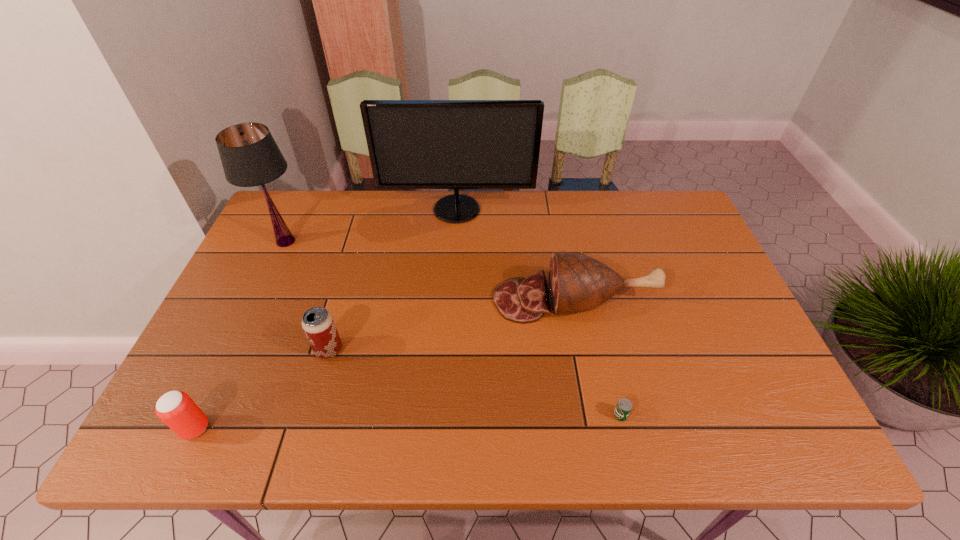
You are a GUI agent. You are given a task and a screenshot of the screen. Output one action in this format:
    pyautogui.click(x=<x>, y=<y>)
    Task: Click on the object that is at the far left corner
    This screenshot has width=960, height=540.
    Given the screenshot: What is the action you would take?
    pyautogui.click(x=250, y=157)

At what (x,y) coordinates should I click in order to perform the action: click on object that is positioned at the near left corner. Please return your answer as a coordinate pair (x, y). The width and height of the screenshot is (960, 540). Looking at the image, I should click on (176, 409).

Image resolution: width=960 pixels, height=540 pixels. I want to click on vacant space at the far edge of the desktop, so (353, 214).

Where is `vacant space at the near edge of the desktop`? The image size is (960, 540). vacant space at the near edge of the desktop is located at coordinates (546, 418).

The height and width of the screenshot is (540, 960). What are the coordinates of `free spot at the left edge of the desktop` in the screenshot? It's located at (247, 320).

Identify the location of vacant space at the right edge. Image resolution: width=960 pixels, height=540 pixels. (693, 307).

The width and height of the screenshot is (960, 540). Find the location of `empty location between the third nearest object and the farthest object`. empty location between the third nearest object and the farthest object is located at coordinates (393, 280).

Find the location of a particular element. The height and width of the screenshot is (540, 960). vacant area that lies between the fifth nearest object and the third object from left to right is located at coordinates (307, 295).

The height and width of the screenshot is (540, 960). Identify the location of free area in between the ham and the shortest object. (597, 357).

The width and height of the screenshot is (960, 540). I want to click on vacant area that lies between the fifth nearest object and the second beer can from right to left, so click(307, 295).